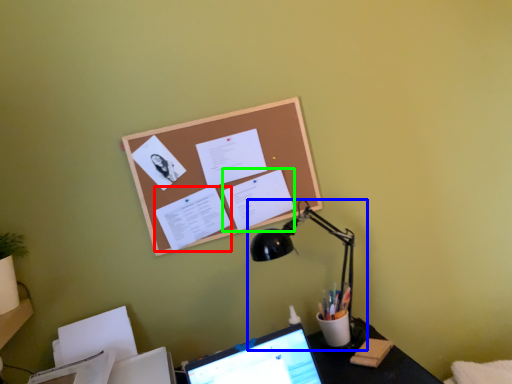
Question: Which is nearer to the document (highlighted by a red box)? lamp (highlighted by a blue box) or document (highlighted by a green box).

Choices:
 (A) lamp
 (B) document

Answer: (B)